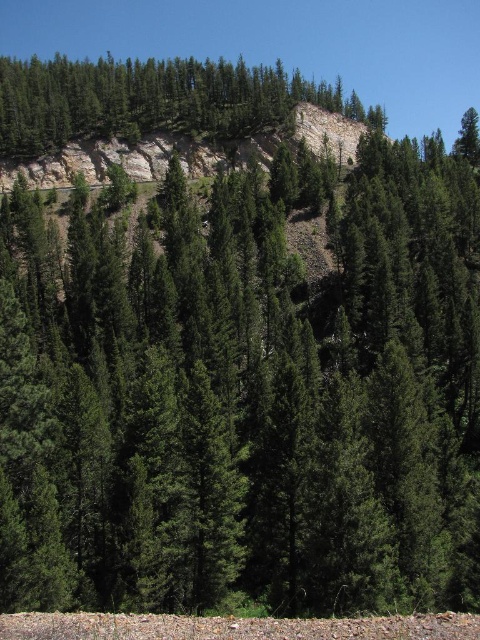
You are a hiker who wants to climb the rustic stone cliff at upper center. You notice a green textured rock at upper center nearby. Which object is positioned higher in the scene?

The green textured rock at upper center is above the rustic stone cliff at upper center, so it is positioned higher in the scene.

You are standing in the forest and want to reach a specific point marked at coordinates point (279, 68). If your maximum comfortable walking distance is 150 meters, will you be able to comfortably reach that point?

The point (279, 68) is 173.22 meters away from the viewer, which exceeds your maximum comfortable walking distance of 150 meters. Therefore, you will not be able to comfortably reach that point.

You are a hiker trying to climb the rocks in the forest. You see a green textured rock at upper center and a rustic stone cliff at upper center. Which one is taller?

The green textured rock at upper center is taller than the rustic stone cliff at upper center according to the description.